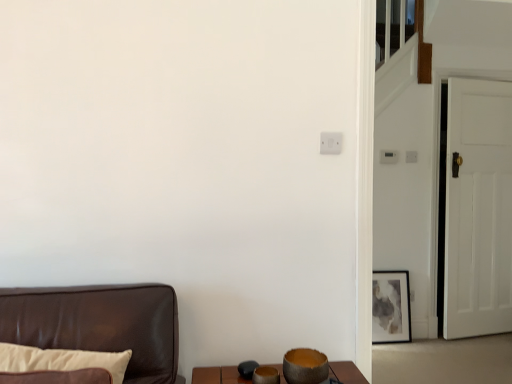
Question: Considering the positions of white wooden door at right and matte gray painting at right in the image, is white wooden door at right taller or shorter than matte gray painting at right?

Choices:
 (A) tall
 (B) short

Answer: (A)

Question: Is point (508, 152) closer or farther from the camera than point (400, 324)?

Choices:
 (A) closer
 (B) farther

Answer: (B)

Question: Estimate the real-world distances between objects in this image. Which object is farther from the white wooden door at right?

Choices:
 (A) matte gray painting at right
 (B) white plastic light switch at upper right

Answer: (B)

Question: Based on their relative distances, which object is nearer to the white wooden door at right?

Choices:
 (A) matte gray painting at right
 (B) white plastic light switch at upper right

Answer: (A)